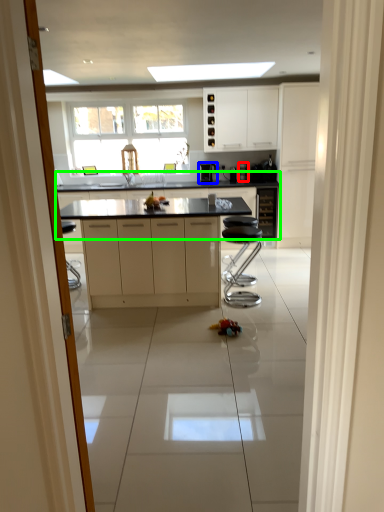
Question: Which object is the farthest from coffee machine (highlighted by a red box)? Choose among these: coffee machine (highlighted by a blue box) or countertop (highlighted by a green box).

Choices:
 (A) coffee machine
 (B) countertop

Answer: (B)